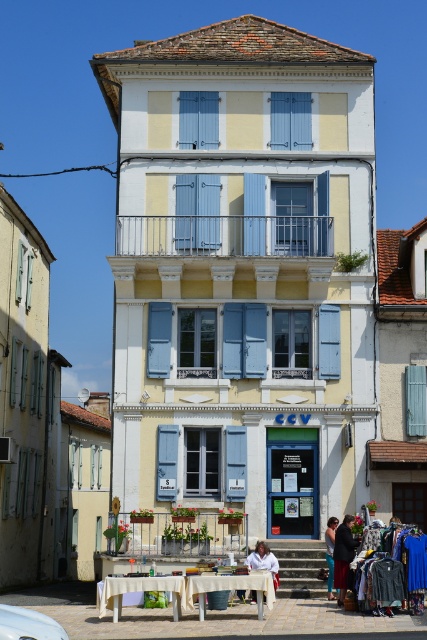
Question: Which point is closer to the camera?

Choices:
 (A) (350, 532)
 (B) (262, 561)

Answer: (A)

Question: Is matte glass window at center wider than white matte car at lower left?

Choices:
 (A) no
 (B) yes

Answer: (B)

Question: Can you confirm if dark gray fabric coat at lower right is positioned to the right of white fabric at lower center?

Choices:
 (A) no
 (B) yes

Answer: (B)

Question: Can you confirm if dark gray fabric coat at lower right is wider than white fabric at lower center?

Choices:
 (A) no
 (B) yes

Answer: (A)

Question: Among these points, which one is nearest to the camera?

Choices:
 (A) (345, 547)
 (B) (283, 483)

Answer: (A)

Question: Which point is closer to the camera?

Choices:
 (A) pyautogui.click(x=341, y=580)
 (B) pyautogui.click(x=327, y=589)

Answer: (A)